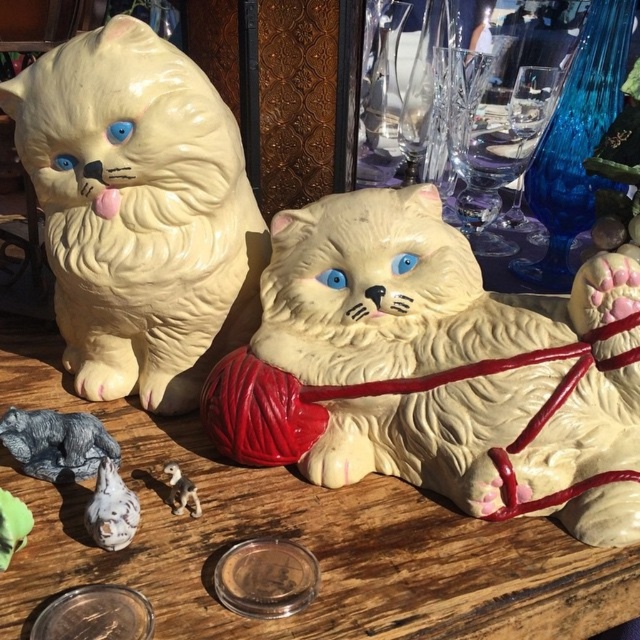
Question: Which of the following is the farthest from the observer?

Choices:
 (A) (193, 513)
 (B) (186, 372)

Answer: (B)

Question: Can you confirm if textured gray cat at lower left is smaller than white glossy cat at lower left?

Choices:
 (A) yes
 (B) no

Answer: (B)

Question: Can you confirm if wooden table at center is thinner than white glossy cat at lower left?

Choices:
 (A) yes
 (B) no

Answer: (B)

Question: Can you confirm if wooden table at center is wider than matte white cat at left?

Choices:
 (A) yes
 (B) no

Answer: (A)

Question: Which point is closer to the camera?

Choices:
 (A) white glossy figurine at lower center
 (B) matte white cat at center
 (C) wooden table at center
 (D) matte white cat at left

Answer: (C)

Question: Which of the following is the farthest from the observer?

Choices:
 (A) (58, 572)
 (B) (116, 493)
 (C) (429, 257)

Answer: (C)